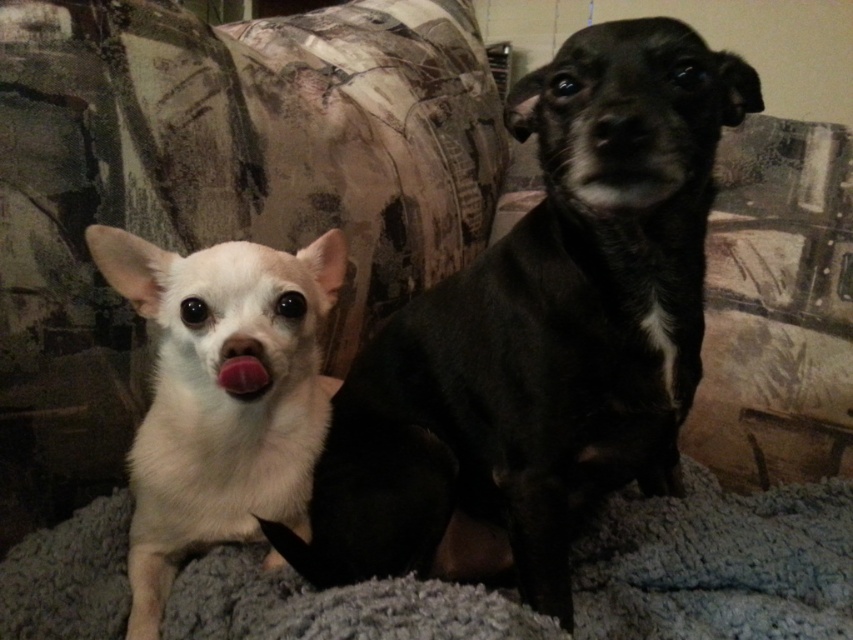
Question: Is gray fluffy blanket at lower center smaller than pink glossy tongue at center?

Choices:
 (A) yes
 (B) no

Answer: (B)

Question: Among these objects, which one is farthest from the camera?

Choices:
 (A) gray fluffy blanket at lower center
 (B) pink glossy tongue at center
 (C) black smooth nose at center
 (D) white fluffy dog at left

Answer: (D)

Question: Which object is closer to the camera taking this photo?

Choices:
 (A) black smooth nose at center
 (B) white fluffy dog at left

Answer: (A)

Question: Considering the relative positions of black smooth dog at upper center and gray fluffy blanket at lower center in the image provided, where is black smooth dog at upper center located with respect to gray fluffy blanket at lower center?

Choices:
 (A) above
 (B) below

Answer: (A)

Question: Among these points, which one is nearest to the camera?

Choices:
 (A) (671, 582)
 (B) (234, 380)

Answer: (B)

Question: Can you confirm if black smooth dog at upper center is positioned to the right of white fluffy dog at left?

Choices:
 (A) no
 (B) yes

Answer: (B)